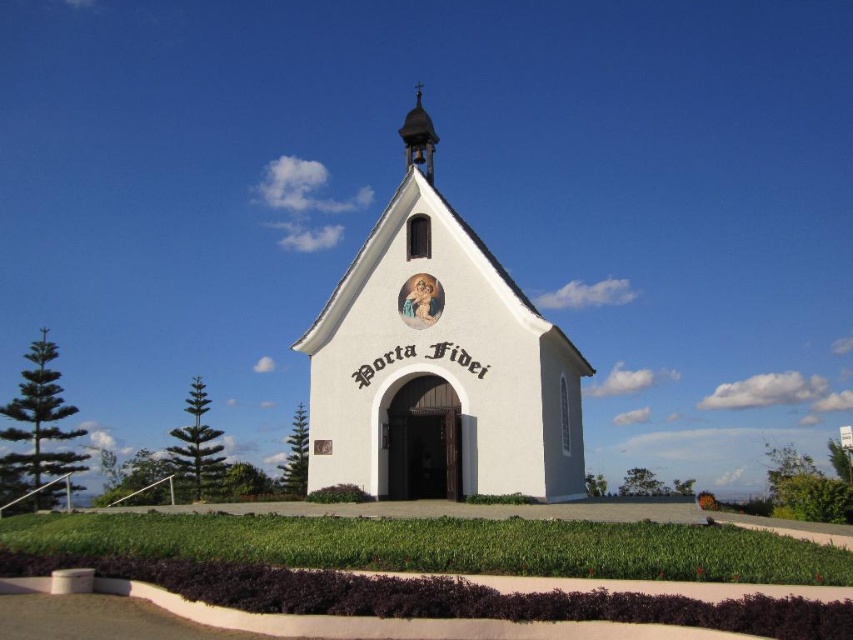
You are standing in front of the white painted wood chapel at center and looking towards the shiny gold spire at upper center. Which object takes up more visual space in your view?

The shiny gold spire at upper center takes up more visual space than the white painted wood chapel at center because it occupies more space according to the description.

You are standing in front of the white painted wood chapel at center and the shiny gold spire at upper center. Which object is located to the left of the other?

The shiny gold spire at upper center is located to the left of the white painted wood chapel at center because the chapel is positioned on the right side of the spire.